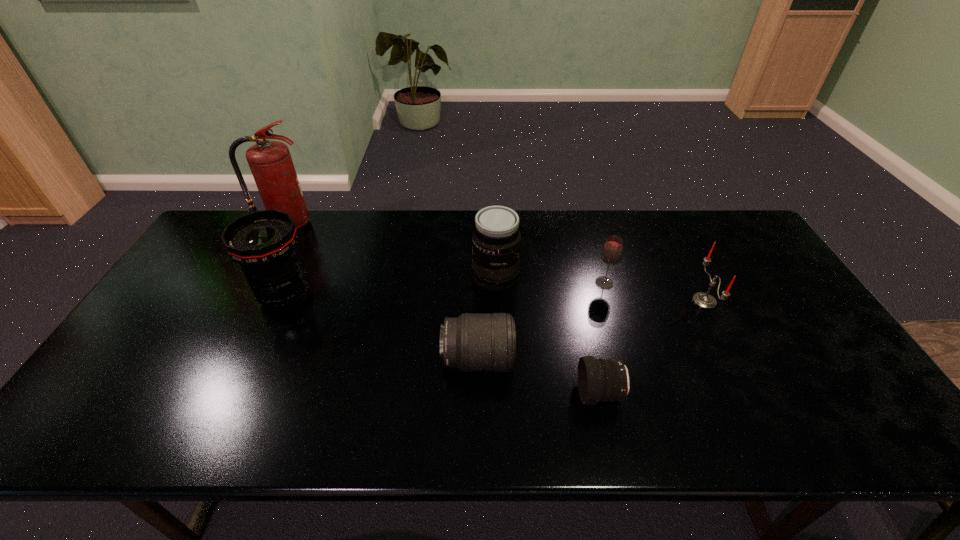
This screenshot has height=540, width=960. What are the coordinates of `the farthest object` in the screenshot? It's located at (270, 162).

I want to click on the tallest object, so (x=270, y=162).

Find the location of a particular element. the leftmost telephoto lens is located at coordinates (264, 243).

Image resolution: width=960 pixels, height=540 pixels. Find the location of `candle`. candle is located at coordinates coord(704,300).

Where is `the second object from right to left`? The height and width of the screenshot is (540, 960). the second object from right to left is located at coordinates (612, 251).

Where is `the second shortest telephoto lens`? The width and height of the screenshot is (960, 540). the second shortest telephoto lens is located at coordinates (474, 342).

This screenshot has height=540, width=960. Find the location of `the shortest telephoto lens`. the shortest telephoto lens is located at coordinates (603, 380).

At what (x,y) coordinates should I click in order to perform the action: click on the fifth object from left to right. Please return your answer as a coordinate pair (x, y). This screenshot has width=960, height=540. Looking at the image, I should click on (603, 380).

Image resolution: width=960 pixels, height=540 pixels. In order to click on vacant space situated 0.330m at the front of the fire extinguisher where the nozzle is aimed in this screenshot , I will do `click(241, 307)`.

The image size is (960, 540). What are the coordinates of `vacant space located on the front of the leftmost telephoto lens` in the screenshot? It's located at (266, 338).